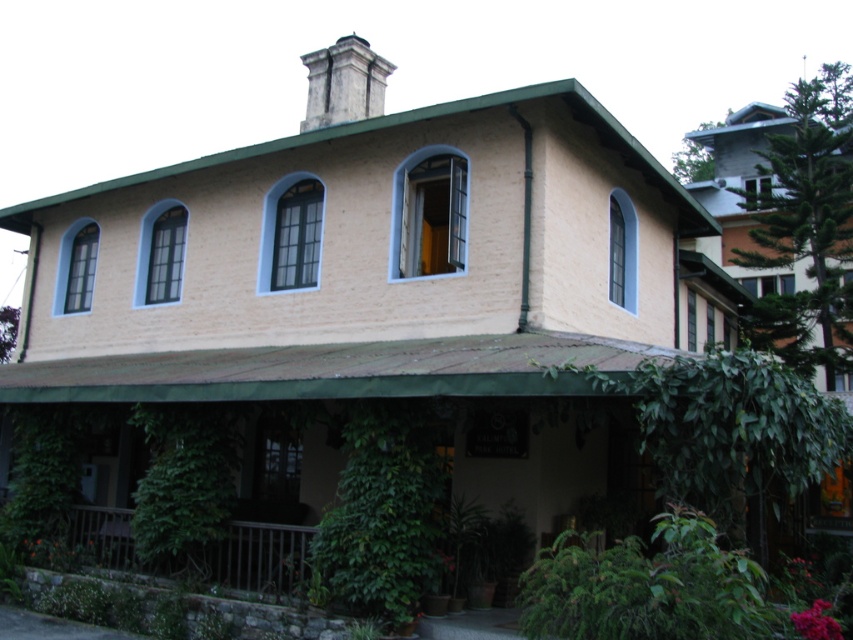
You are standing on the brown wooden porch at lower left and want to place a small statue on the green leafy plant at lower center. Is the plant accessible from your current position?

The green leafy plant at lower center is located above the brown wooden porch at lower left, so you can reach it from the porch to place the statue.

You are standing in front of the building and notice two points marked on the facade. The first point is at coordinates point [367,536] and the second is at point [270,568]. Which of these two points is closer to you?

Point [367,536] is closer to the viewer than point [270,568].